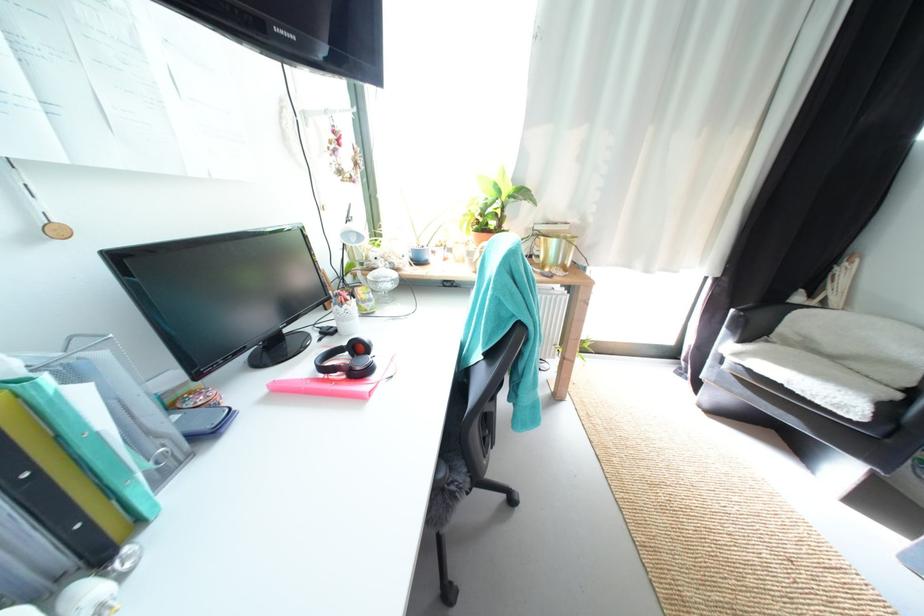
Find the location of a particular element. This screenshot has width=924, height=616. gold planter pot is located at coordinates (554, 251).